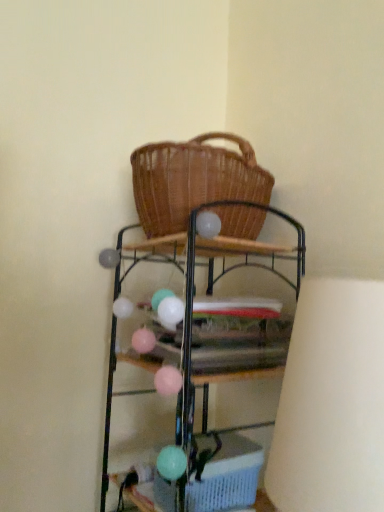
Where is `vacant area on top of light blue plastic basket at lower center (from a real-world perspective)`? This screenshot has width=384, height=512. vacant area on top of light blue plastic basket at lower center (from a real-world perspective) is located at coordinates (222, 443).